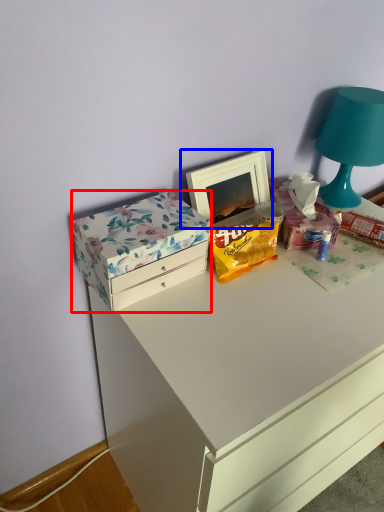
Question: Which point is closer to the camera, box (highlighted by a red box) or picture frame (highlighted by a blue box)?

Choices:
 (A) box
 (B) picture frame

Answer: (A)